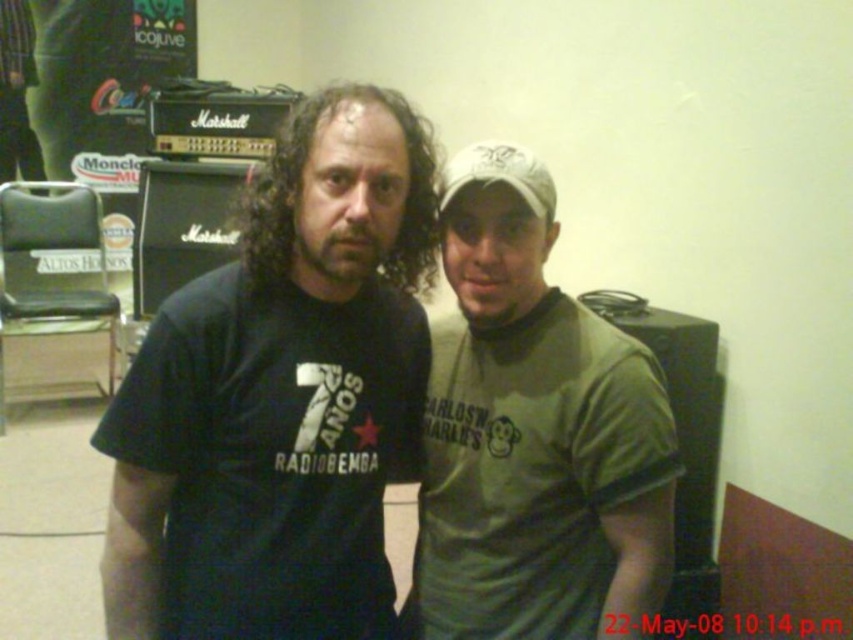
Consider the image. You are standing in a music venue and want to place a 1 meter long banner between the two people. The banner must be placed at a point that is exactly 1 meter away from you. Is the point at coordinate point [177,330] suitable for placing the banner?

The point at coordinate point [177,330] is 97.41 centimeters from the viewer, which is less than 1 meter. Therefore, it is not suitable for placing the banner at exactly 1 meter away.

You are a photographer setting up for a photoshoot in this music venue. You need to position a spotlight at coordinates point (532, 435). Which object will the spotlight illuminate?

The spotlight at point (532, 435) will illuminate the green matte t shirt at center.